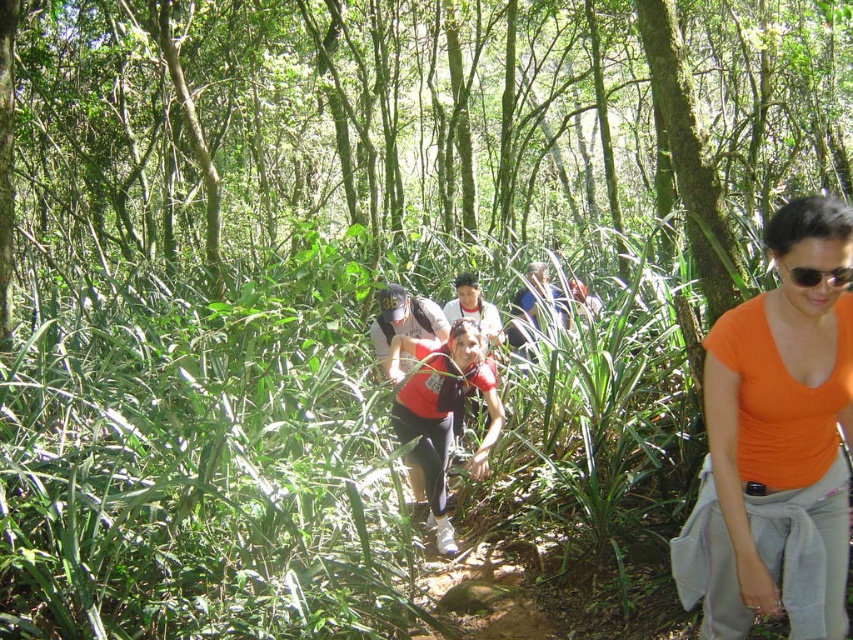
You are a hiker trying to identify two people in the forest. You see an orange matte shirt at center and a red matte shirt at center. Which person has a wider torso?

The red matte shirt at center has a wider torso because the orange matte shirt at center is narrower than it.

You are a photographer trying to capture a photo of the red matte shirt at center and the black plastic sunglasses at right in the forest scene. Since you want both subjects to be in focus, you need to know their relative heights. Which object is taller?

The red matte shirt at center is much taller than the black plastic sunglasses at right, so you should adjust your camera settings to account for the height difference to ensure both are in focus.